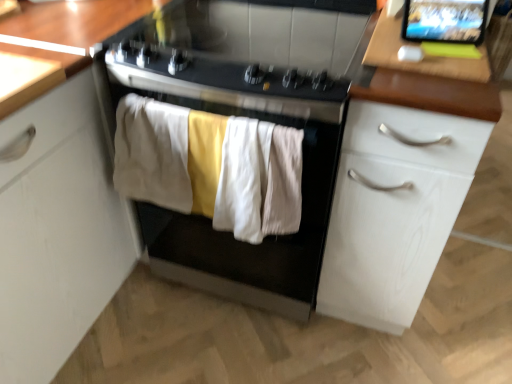
Where is `vacant space to the right of white wood cabinet at right`? Image resolution: width=512 pixels, height=384 pixels. vacant space to the right of white wood cabinet at right is located at coordinates (464, 299).